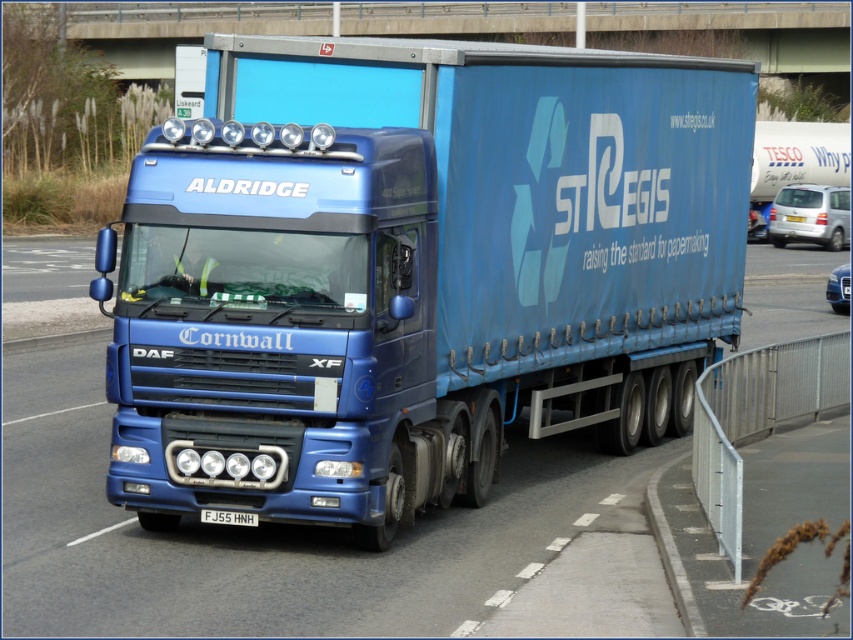
You are a photographer trying to capture both the matte blue trailer truck at center and the blue metallic truck at center in a single shot. Since you want them to appear side by side, does the current arrangement allow you to frame them together without moving the camera?

The matte blue trailer truck at center is positioned on the right side of the blue metallic truck at center, so they are already arranged side by side. This means you can capture both in a single shot without moving the camera.

In the scene shown: You are a photographer trying to capture the matte blue trailer truck at center and the white plastic license plate at center in a single shot. Which object should you focus on first to ensure both are in frame?

The matte blue trailer truck at center is in front of the white plastic license plate at center, so you should focus on the matte blue trailer truck at center first to ensure both are in frame.